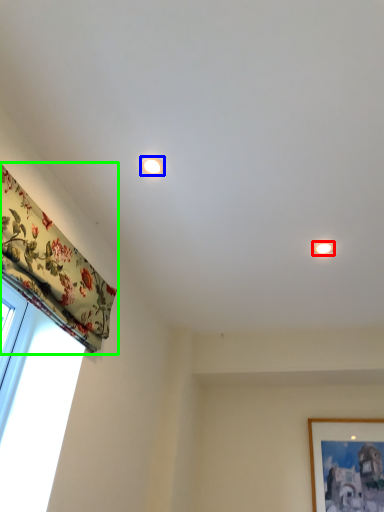
Question: Which object is positioned farthest from lighting (highlighted by a red box)? Select from lighting (highlighted by a blue box) and curtain (highlighted by a green box).

Choices:
 (A) lighting
 (B) curtain

Answer: (B)